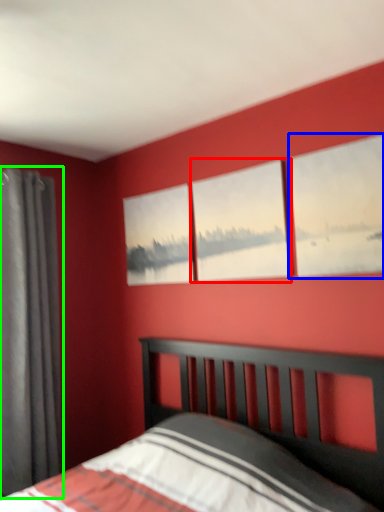
Question: Estimate the real-world distances between objects in this image. Which object is farther from window (highlighted by a red box), window (highlighted by a blue box) or curtain (highlighted by a green box)?

Choices:
 (A) window
 (B) curtain

Answer: (B)